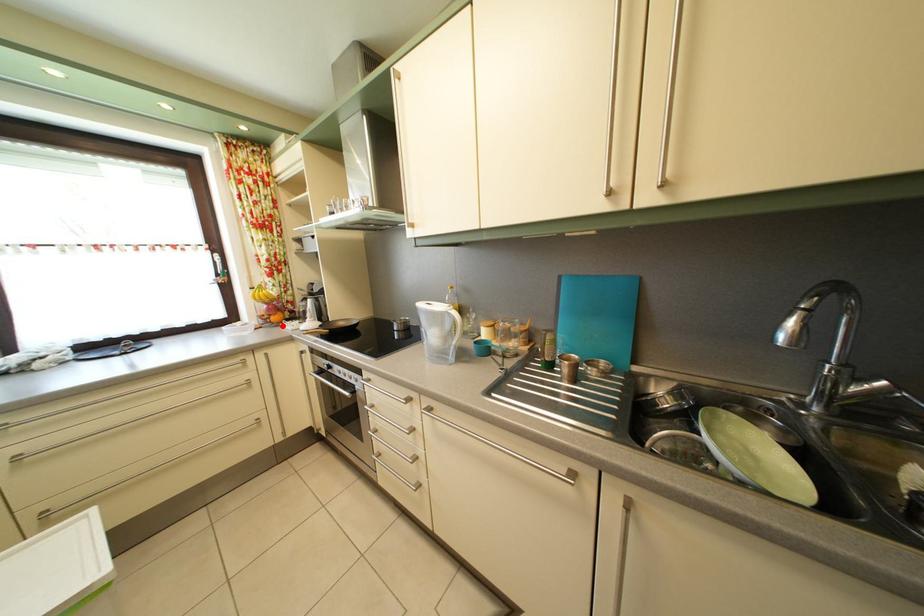
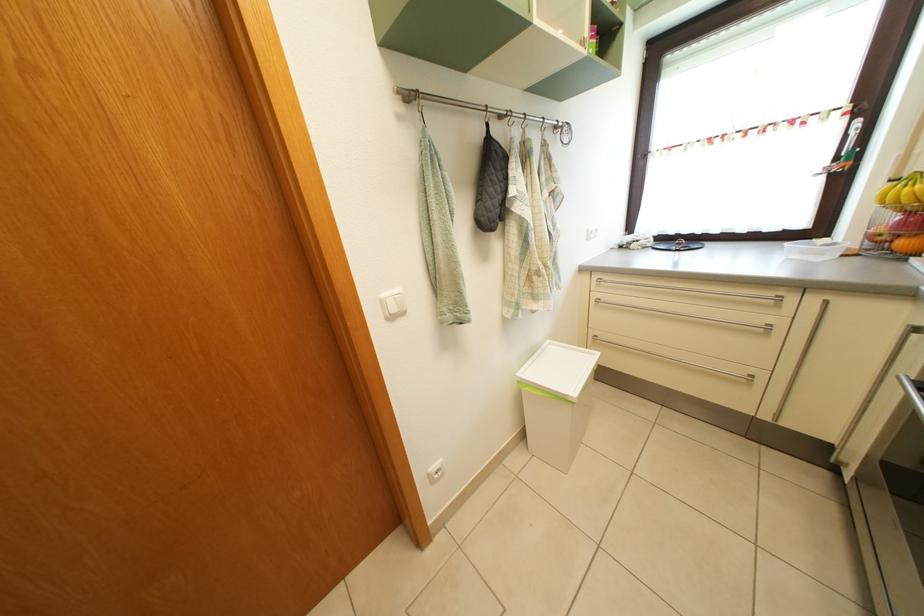
Locate, in the second image, the point that corresponds to the highlighted location in the first image.

(910, 252)